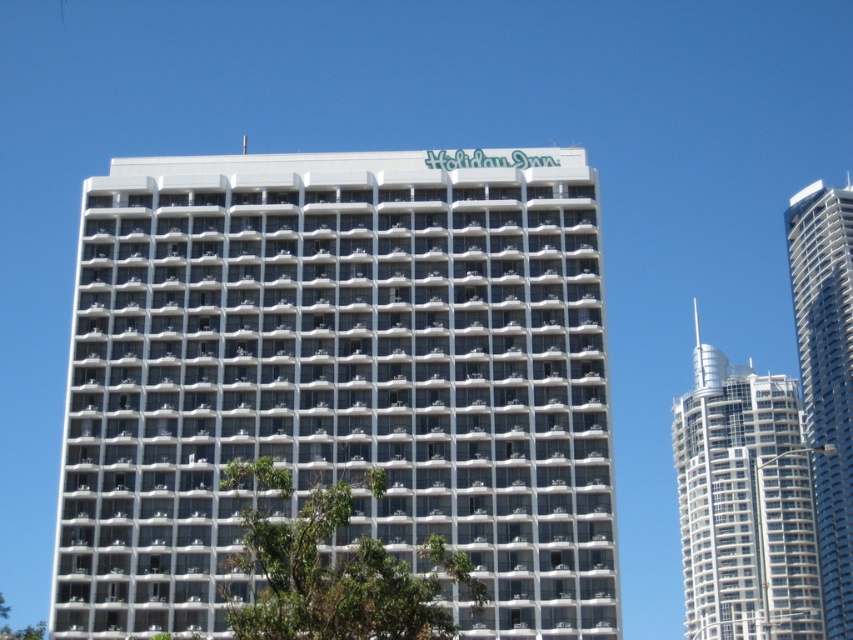
Does white glass building at center have a greater height compared to green leafy tree at lower left?

Incorrect, white glass building at center's height is not larger of green leafy tree at lower left's.

Who is lower down, white glass building at center or green leafy tree at lower left?

Positioned lower is green leafy tree at lower left.

This screenshot has height=640, width=853. What do you see at coordinates (339, 376) in the screenshot?
I see `white glass building at center` at bounding box center [339, 376].

Image resolution: width=853 pixels, height=640 pixels. Identify the location of white glass building at center. (339, 376).

Can you confirm if white glass building at right is positioned above green leafy tree at lower left?

Yes.

Can you confirm if white glass building at right is thinner than green leafy tree at lower left?

Indeed, white glass building at right has a lesser width compared to green leafy tree at lower left.

At what (x,y) coordinates should I click in order to perform the action: click on white glass building at right. Please return your answer as a coordinate pair (x, y). The height and width of the screenshot is (640, 853). Looking at the image, I should click on (746, 502).

Is white glass building at center positioned in front of white glass skyscraper at right?

Yes, white glass building at center is in front of white glass skyscraper at right.

Does white glass building at center appear on the right side of white glass skyscraper at right?

No, white glass building at center is not to the right of white glass skyscraper at right.

Does point (184, 339) come farther from viewer compared to point (846, 312)?

No, (184, 339) is closer to viewer.

At what (x,y) coordinates should I click in order to perform the action: click on white glass building at center. Please return your answer as a coordinate pair (x, y). This screenshot has height=640, width=853. Looking at the image, I should click on (339, 376).